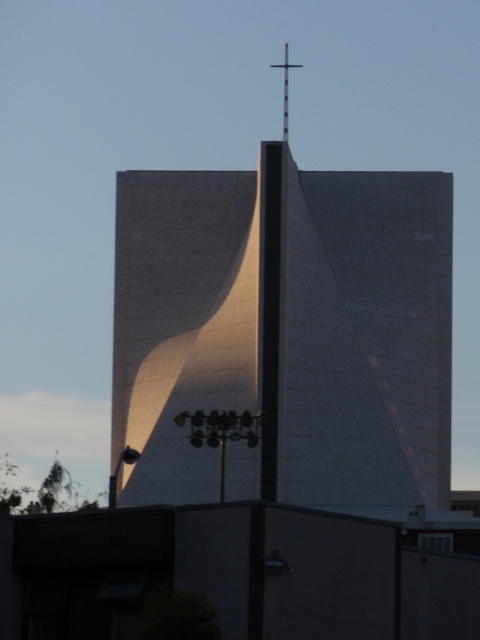
Based on the photo, you are standing at the base of the church tower and want to know how far the point marked at coordinates point (x=282, y=172) is from you. Can you determine the distance?

The point marked at coordinates point (x=282, y=172) is 726.31 feet away from the camera, so the distance from your current position at the base of the church tower to that point is approximately 726.31 feet.

You are standing in front of the modern church structure and notice two points marked on the tower. The first point is at coordinates point [203,372] and the second is at point [285,77]. Which of these two points is nearer to you?

Point [203,372] is closer to the viewer than point [285,77].

You are a drone operator tasked with flying a drone from the base of the white smooth tower at center to the black metal cross at upper center. The drone has a maximum flight distance of 30 meters. Can the drone complete this mission without needing to recharge?

The distance between the white smooth tower at center and the black metal cross at upper center is 28.87 meters, which is within the drone operator drone maximum flight distance of 30 meters. Therefore, the drone can complete the mission without needing to recharge.